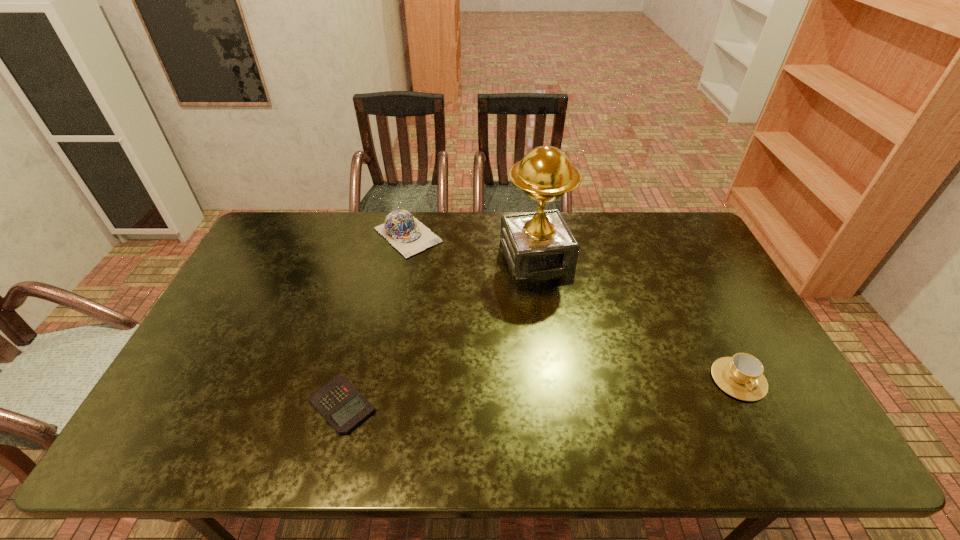
Where is `vacant space at the near edge of the desktop`? The image size is (960, 540). vacant space at the near edge of the desktop is located at coordinates (455, 409).

Locate an element on the screen. This screenshot has width=960, height=540. vacant space at the left edge is located at coordinates (217, 345).

In order to click on vacant space at the right edge in this screenshot , I will do `click(700, 329)`.

The width and height of the screenshot is (960, 540). Find the location of `free space at the near left corner of the desktop`. free space at the near left corner of the desktop is located at coordinates (218, 410).

Identify the location of vacant area that lies between the third object from left to right and the third tallest object. The height and width of the screenshot is (540, 960). (637, 318).

You are a GUI agent. You are given a task and a screenshot of the screen. Output one action in this format:
    pyautogui.click(x=<x>, y=<y>)
    Task: Click on the free space between the calculator and the third shortest object
    This screenshot has height=540, width=960.
    Given the screenshot: What is the action you would take?
    pyautogui.click(x=375, y=320)

Image resolution: width=960 pixels, height=540 pixels. I want to click on unoccupied area between the second shortest object and the tallest object, so click(637, 318).

At what (x,y) coordinates should I click in order to perform the action: click on free spot between the tallest object and the third shortest object. Please return your answer as a coordinate pair (x, y). The height and width of the screenshot is (540, 960). Looking at the image, I should click on (472, 245).

In order to click on free area in between the cap and the third object from left to right in this screenshot , I will do `click(472, 245)`.

At what (x,y) coordinates should I click in order to perform the action: click on unoccupied position between the second shortest object and the tallest object. Please return your answer as a coordinate pair (x, y). Looking at the image, I should click on (637, 318).